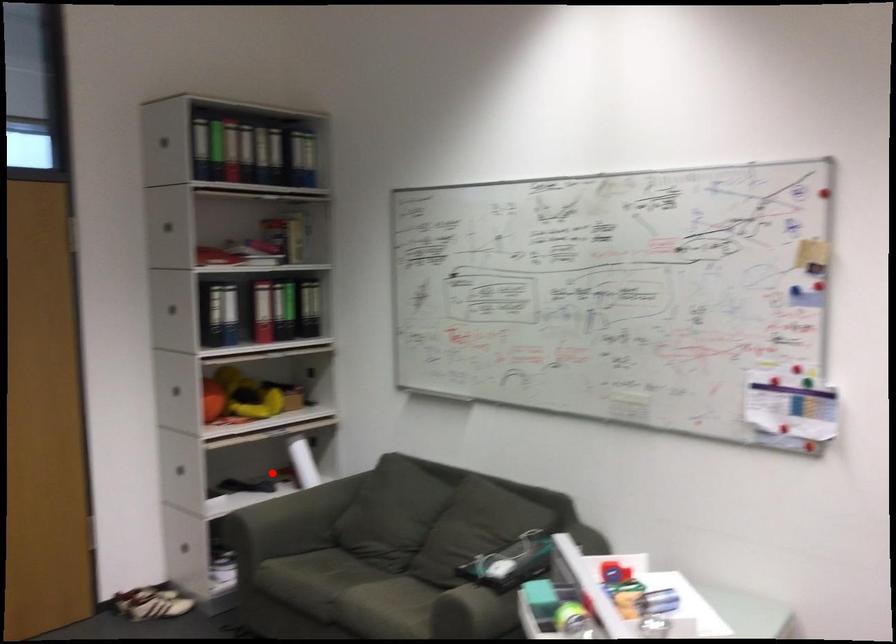
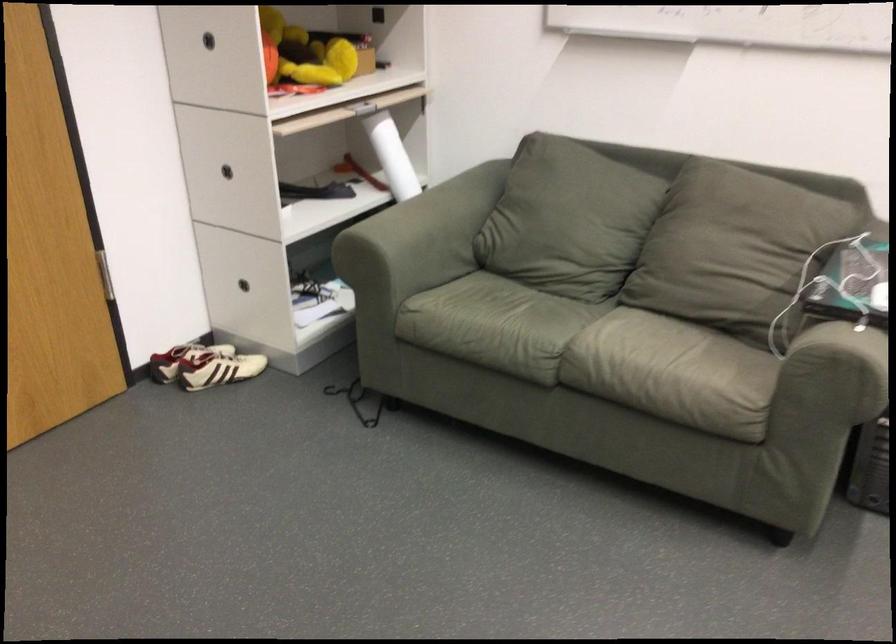
Locate, in the second image, the point that corresponds to the highlighted location in the first image.

(330, 161)